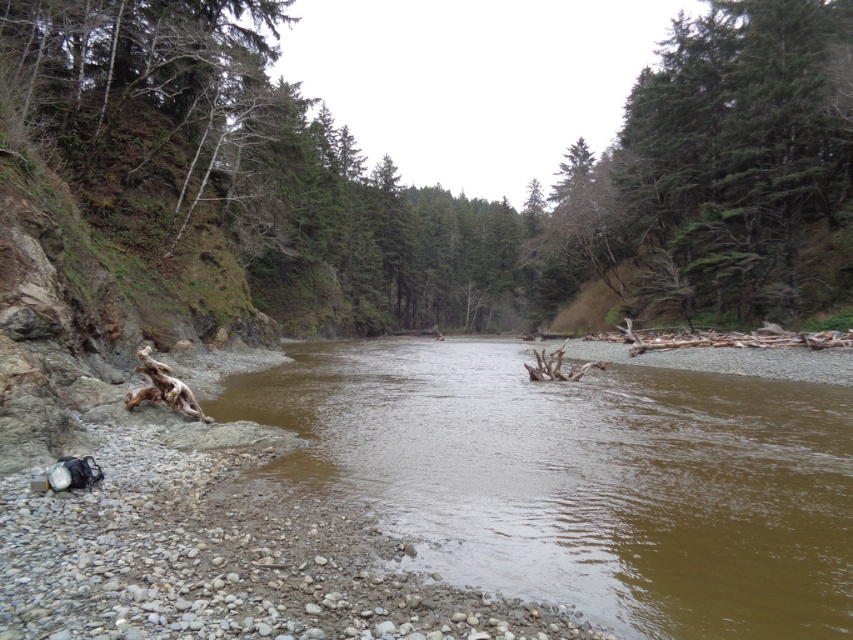
Question: Does brown muddy water at center have a greater width compared to green textured tree at upper right?

Choices:
 (A) yes
 (B) no

Answer: (A)

Question: Does brown muddy water at center have a greater width compared to green textured tree at upper right?

Choices:
 (A) no
 (B) yes

Answer: (B)

Question: Which point appears closest to the camera in this image?

Choices:
 (A) (544, 240)
 (B) (602, 563)

Answer: (B)

Question: Among these objects, which one is nearest to the camera?

Choices:
 (A) brown muddy water at center
 (B) green textured tree at upper right

Answer: (A)

Question: Can you confirm if brown muddy water at center is positioned above green textured tree at upper right?

Choices:
 (A) yes
 (B) no

Answer: (B)